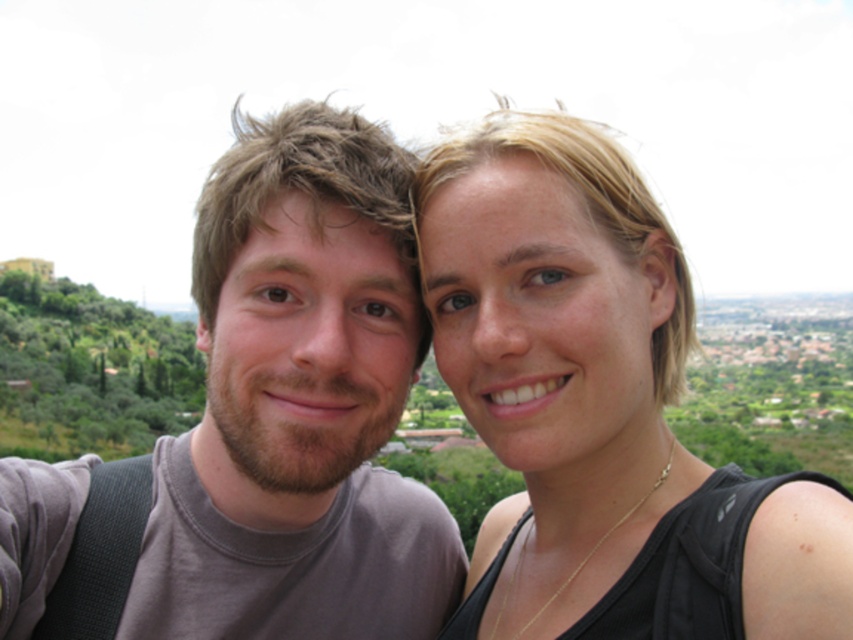
Can you confirm if matte black tank top at center is thinner than gray matte t-shirt at center?

Yes, matte black tank top at center is thinner than gray matte t-shirt at center.

Does matte black tank top at center appear on the right side of gray matte t-shirt at center?

Indeed, matte black tank top at center is positioned on the right side of gray matte t-shirt at center.

What are the coordinates of `matte black tank top at center` in the screenshot? It's located at (601, 408).

Where is `matte black tank top at center`? matte black tank top at center is located at coordinates coord(601,408).